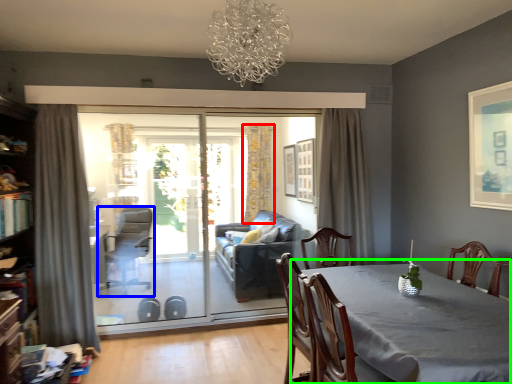
Question: Estimate the real-world distances between objects in this image. Which object is closer to curtain (highlighted by a red box), swivel chair (highlighted by a blue box) or table (highlighted by a green box)?

Choices:
 (A) swivel chair
 (B) table

Answer: (A)